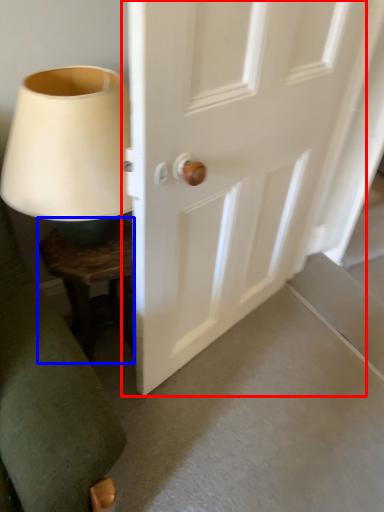
Question: Which object appears farthest to the camera in this image, door (highlighted by a red box) or furniture (highlighted by a blue box)?

Choices:
 (A) door
 (B) furniture

Answer: (B)